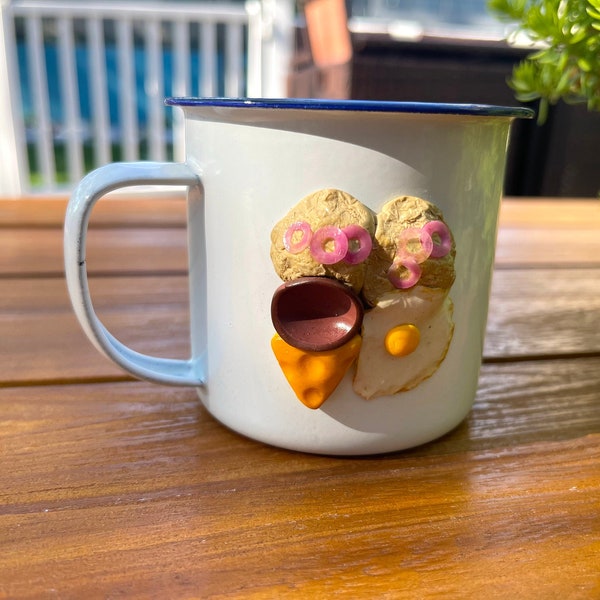
Locate an element on the screen. mug lip is located at coordinates (269, 103).